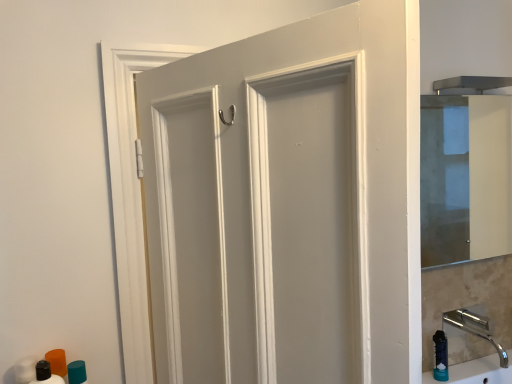
Question: Considering the relative sizes of teal matte cylinder at lower left, the 1th toiletry viewed from the back, and transparent glass cabinet at right in the image provided, is teal matte cylinder at lower left, the 1th toiletry viewed from the back, taller than transparent glass cabinet at right?

Choices:
 (A) no
 (B) yes

Answer: (A)

Question: Is teal matte cylinder at lower left, the 2th toiletry from the front, turned away from transparent glass cabinet at right?

Choices:
 (A) yes
 (B) no

Answer: (B)

Question: Considering the relative positions of teal matte cylinder at lower left, the 1th toiletry viewed from the back, and transparent glass cabinet at right in the image provided, is teal matte cylinder at lower left, the 1th toiletry viewed from the back, in front of transparent glass cabinet at right?

Choices:
 (A) yes
 (B) no

Answer: (A)

Question: Considering the relative positions of teal matte cylinder at lower left, the 2th toiletry from the front, and transparent glass cabinet at right in the image provided, is teal matte cylinder at lower left, the 2th toiletry from the front, to the left of transparent glass cabinet at right from the viewer's perspective?

Choices:
 (A) yes
 (B) no

Answer: (A)

Question: From a real-world perspective, is teal matte cylinder at lower left, the 1th toiletry viewed from the back, physically above transparent glass cabinet at right?

Choices:
 (A) no
 (B) yes

Answer: (A)

Question: Is teal matte cylinder at lower left, the 1th toiletry viewed from the back, positioned in front of matte white door at center?

Choices:
 (A) yes
 (B) no

Answer: (B)

Question: From a real-world perspective, is teal matte cylinder at lower left, the 1th toiletry viewed from the back, physically below matte white door at center?

Choices:
 (A) no
 (B) yes

Answer: (B)

Question: Is teal matte cylinder at lower left, the 1th toiletry viewed from the back, smaller than matte white door at center?

Choices:
 (A) yes
 (B) no

Answer: (A)

Question: Does teal matte cylinder at lower left, the 2th toiletry from the front, have a greater height compared to matte white door at center?

Choices:
 (A) no
 (B) yes

Answer: (A)

Question: Does teal matte cylinder at lower left, the 1th toiletry viewed from the back, turn towards matte white door at center?

Choices:
 (A) no
 (B) yes

Answer: (A)

Question: Is teal matte cylinder at lower left, the 2th toiletry from the front, to the left of matte white door at center from the viewer's perspective?

Choices:
 (A) yes
 (B) no

Answer: (A)

Question: Considering the relative sizes of teal matte cylinder at lower left, the 1th toiletry viewed from the back, and polished chrome faucet at lower right in the image provided, is teal matte cylinder at lower left, the 1th toiletry viewed from the back, smaller than polished chrome faucet at lower right?

Choices:
 (A) no
 (B) yes

Answer: (B)